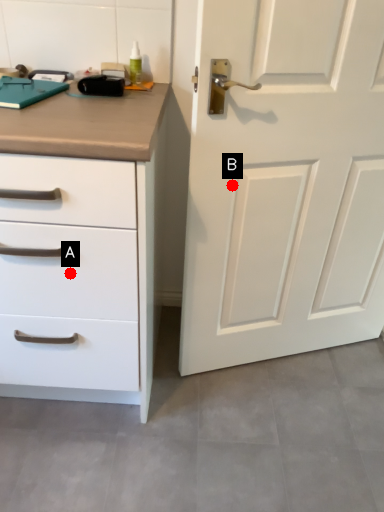
Question: Two points are circled on the image, labeled by A and B beside each circle. Which point is farther from the camera taking this photo?

Choices:
 (A) A is further
 (B) B is further

Answer: (B)